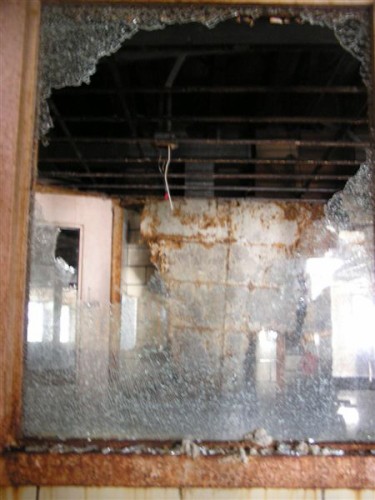
Locate an element on the screen. This screenshot has height=500, width=375. door in window is located at coordinates (67, 203), (101, 221), (96, 287), (97, 387).